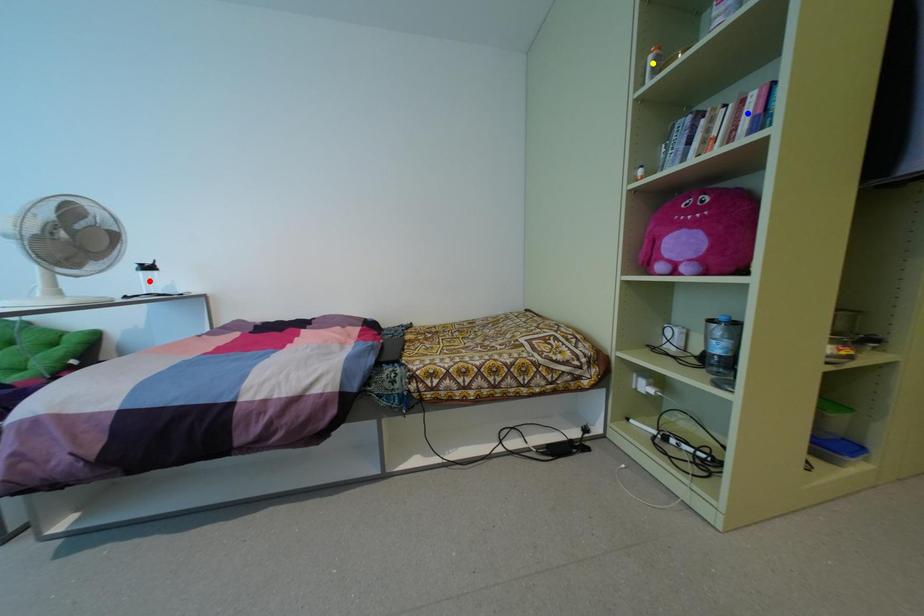
Order these from nearest to farthest:
blue point, red point, yellow point

blue point < yellow point < red point